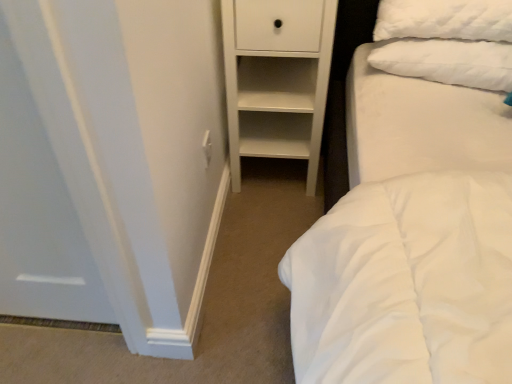
The height and width of the screenshot is (384, 512). Describe the element at coordinates (448, 62) in the screenshot. I see `white fluffy pillow at upper right` at that location.

Image resolution: width=512 pixels, height=384 pixels. Identify the location of white plastic electric outlet at center. (207, 148).

From a real-world perspective, which object stands above the other?

In real-world perspective, white fluffy pillow at upper right is above.

Does white plastic electric outlet at center have a lesser height compared to white fluffy pillow at upper right?

Correct, white plastic electric outlet at center is not as tall as white fluffy pillow at upper right.

How many degrees apart are the facing directions of white plastic electric outlet at center and white fluffy pillow at upper right?

They differ by 96.3 degrees in their facing directions.

Does white plastic electric outlet at center touch white fluffy pillow at upper right?

No, white plastic electric outlet at center is not making contact with white fluffy pillow at upper right.

Is white fluffy pillow at upper right wider than white plastic electric outlet at center?

Yes, white fluffy pillow at upper right is wider than white plastic electric outlet at center.

Is there a large distance between white fluffy pillow at upper right and white plastic electric outlet at center?

No, there isn't a large distance between white fluffy pillow at upper right and white plastic electric outlet at center.

Do you think white fluffy pillow at upper right is within white plastic electric outlet at center, or outside of it?

white fluffy pillow at upper right exists outside the volume of white plastic electric outlet at center.

How distant is white fluffy pillow at upper right from white plastic electric outlet at center?

They are 29.70 inches apart.

Is white matte chest of drawers at center smaller than white plastic electric outlet at center?

No, white matte chest of drawers at center is not smaller than white plastic electric outlet at center.

Which is closer, (307, 136) or (208, 132)?

The point (208, 132) is closer.

Identify the location of electric outlet below the white matte chest of drawers at center (from the image's perspective). The width and height of the screenshot is (512, 384). (207, 148).

Is white matte chest of drawers at center facing away from white plastic electric outlet at center?

No, white matte chest of drawers at center is not facing away from white plastic electric outlet at center.

Does white matte chest of drawers at center come behind white fluffy pillow at upper right?

No, white matte chest of drawers at center is closer to the viewer.

Is point (243, 136) more distant than point (436, 52)?

That is True.

Is white fluffy pillow at upper right surrounded by white matte chest of drawers at center?

No, white fluffy pillow at upper right is not inside white matte chest of drawers at center.

Does white matte chest of drawers at center have a lesser height compared to white fluffy pillow at upper right?

Incorrect, the height of white matte chest of drawers at center does not fall short of that of white fluffy pillow at upper right.

Consider the image. From a real-world perspective, is white plastic electric outlet at center located higher than white matte chest of drawers at center?

Yes, from a real-world perspective, white plastic electric outlet at center is on top of white matte chest of drawers at center.

Which is more to the right, white plastic electric outlet at center or white matte chest of drawers at center?

white matte chest of drawers at center.

How different are the orientations of white plastic electric outlet at center and white matte chest of drawers at center in degrees?

The facing directions of white plastic electric outlet at center and white matte chest of drawers at center are 88.9 degrees apart.

Where is `electric outlet that appears on the left of white matte chest of drawers at center`? electric outlet that appears on the left of white matte chest of drawers at center is located at coordinates (207, 148).

Is the surface of white fluffy pillow at upper right in direct contact with white matte chest of drawers at center?

No, white fluffy pillow at upper right is not next to white matte chest of drawers at center.

Could you tell me if white fluffy pillow at upper right is facing white matte chest of drawers at center?

No, white fluffy pillow at upper right is not turned towards white matte chest of drawers at center.

Can you confirm if white fluffy pillow at upper right is bigger than white matte chest of drawers at center?

Incorrect, white fluffy pillow at upper right is not larger than white matte chest of drawers at center.

Image resolution: width=512 pixels, height=384 pixels. I want to click on pillow above the white plastic electric outlet at center (from the image's perspective), so click(448, 62).

Identify the location of pillow positioned vertically above the white plastic electric outlet at center (from a real-world perspective). Image resolution: width=512 pixels, height=384 pixels. click(x=448, y=62).

Considering their positions, is white fluffy pillow at upper right positioned closer to white matte chest of drawers at center than white plastic electric outlet at center?

Among the two, white fluffy pillow at upper right is located nearer to white matte chest of drawers at center.

Based on their spatial positions, is white plastic electric outlet at center or white fluffy pillow at upper right further from white matte chest of drawers at center?

white plastic electric outlet at center is positioned further to the anchor white matte chest of drawers at center.

When comparing their distances from white fluffy pillow at upper right, does white plastic electric outlet at center or white matte chest of drawers at center seem closer?

The object closer to white fluffy pillow at upper right is white matte chest of drawers at center.

Looking at the image, which one is located closer to white fluffy pillow at upper right, white matte chest of drawers at center or white plastic electric outlet at center?

white matte chest of drawers at center lies closer to white fluffy pillow at upper right than the other object.

From the image, which object appears to be nearer to white plastic electric outlet at center, white matte chest of drawers at center or white fluffy pillow at upper right?

white matte chest of drawers at center lies closer to white plastic electric outlet at center than the other object.

Based on their spatial positions, is white fluffy pillow at upper right or white matte chest of drawers at center further from white plastic electric outlet at center?

Based on the image, white fluffy pillow at upper right appears to be further to white plastic electric outlet at center.

The width and height of the screenshot is (512, 384). Identify the location of the chest of drawers situated between white plastic electric outlet at center and white fluffy pillow at upper right from left to right. (277, 79).